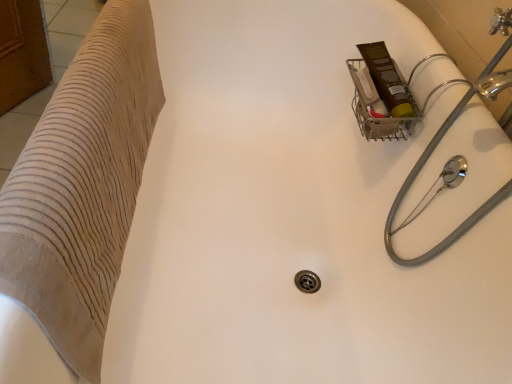
Question: Does gray rubber hose at upper right have a greater height compared to beige textured towel at left?

Choices:
 (A) yes
 (B) no

Answer: (A)

Question: Is gray rubber hose at upper right far from beige textured towel at left?

Choices:
 (A) no
 (B) yes

Answer: (A)

Question: Is gray rubber hose at upper right bigger than beige textured towel at left?

Choices:
 (A) no
 (B) yes

Answer: (B)

Question: Is beige textured towel at left completely or partially inside gray rubber hose at upper right?

Choices:
 (A) no
 (B) yes

Answer: (A)

Question: Does gray rubber hose at upper right appear on the right side of beige textured towel at left?

Choices:
 (A) no
 (B) yes

Answer: (B)

Question: From a real-world perspective, is gray rubber hose at upper right positioned over beige textured towel at left based on gravity?

Choices:
 (A) yes
 (B) no

Answer: (A)

Question: From a real-world perspective, is beige textured towel at left positioned over gray rubber hose at upper right based on gravity?

Choices:
 (A) yes
 (B) no

Answer: (B)

Question: Can you confirm if beige textured towel at left is bigger than gray rubber hose at upper right?

Choices:
 (A) yes
 (B) no

Answer: (B)

Question: From the image's perspective, is beige textured towel at left above gray rubber hose at upper right?

Choices:
 (A) yes
 (B) no

Answer: (A)

Question: From a real-world perspective, is beige textured towel at left beneath gray rubber hose at upper right?

Choices:
 (A) no
 (B) yes

Answer: (B)

Question: Is beige textured towel at left not within gray rubber hose at upper right?

Choices:
 (A) no
 (B) yes

Answer: (B)

Question: Is beige textured towel at left further to camera compared to gray rubber hose at upper right?

Choices:
 (A) no
 (B) yes

Answer: (A)

Question: Would you say gray rubber hose at upper right is inside or outside beige textured towel at left?

Choices:
 (A) inside
 (B) outside

Answer: (B)